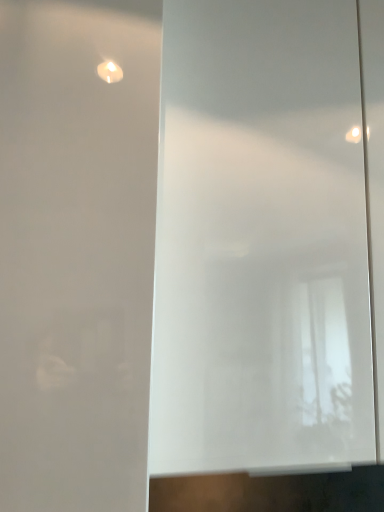
This screenshot has height=512, width=384. What do you see at coordinates (260, 240) in the screenshot?
I see `white glossy mirror at center` at bounding box center [260, 240].

At what (x,y) coordinates should I click in order to perform the action: click on white glossy mirror at center. Please return your answer as a coordinate pair (x, y). Image resolution: width=384 pixels, height=512 pixels. Looking at the image, I should click on (260, 240).

Identify the location of white glossy mirror at center. (260, 240).